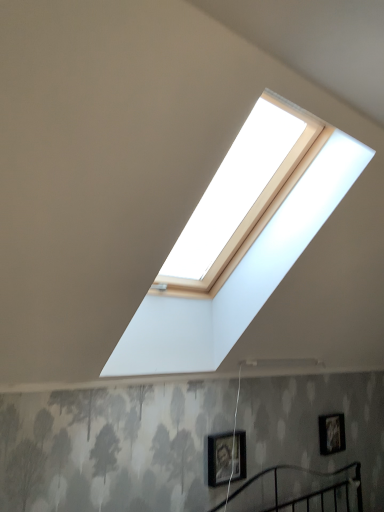
How much space does matte black picture frame at lower center, the second picture frame when ordered from right to left, occupy horizontally?

matte black picture frame at lower center, the second picture frame when ordered from right to left, is 2.41 inches wide.

Locate an element on the screen. This screenshot has height=512, width=384. matte black picture frame at lower center, the 2th picture frame when ordered from back to front is located at coordinates (219, 458).

What do you see at coordinates (219, 458) in the screenshot?
I see `matte black picture frame at lower center, which appears as the first picture frame when viewed from the front` at bounding box center [219, 458].

How much space does matte black picture frame at lower right, which is the 1th picture frame from right to left, occupy horizontally?

The width of matte black picture frame at lower right, which is the 1th picture frame from right to left, is 5.47 centimeters.

How much space does matte black picture frame at lower right, placed as the second picture frame when sorted from left to right, occupy vertically?

matte black picture frame at lower right, placed as the second picture frame when sorted from left to right, is 11.44 inches tall.

Find the location of a particular element. The height and width of the screenshot is (512, 384). matte black picture frame at lower right, the first picture frame viewed from the back is located at coordinates (332, 433).

This screenshot has height=512, width=384. Describe the element at coordinates (332, 433) in the screenshot. I see `matte black picture frame at lower right, the first picture frame viewed from the back` at that location.

This screenshot has height=512, width=384. I want to click on matte black picture frame at lower center, which appears as the first picture frame when viewed from the front, so click(219, 458).

Is matte black picture frame at lower right, marked as the second picture frame in a front-to-back arrangement, to the left of matte black picture frame at lower center, the second picture frame when ordered from right to left, from the viewer's perspective?

No, matte black picture frame at lower right, marked as the second picture frame in a front-to-back arrangement, is not to the left of matte black picture frame at lower center, the second picture frame when ordered from right to left.

Which object is further away from the camera, matte black picture frame at lower right, which is the 1th picture frame from right to left, or matte black picture frame at lower center, which appears as the 1th picture frame when viewed from the left?

matte black picture frame at lower right, which is the 1th picture frame from right to left, is further away from the camera.

Which is in front, point (338, 440) or point (225, 459)?

Point (225, 459)

From the image's perspective, is matte black picture frame at lower right, placed as the second picture frame when sorted from left to right, located above matte black picture frame at lower center, the second picture frame when ordered from right to left?

No.

From a real-world perspective, is matte black picture frame at lower right, which is the 1th picture frame from right to left, above or below matte black picture frame at lower center, the second picture frame when ordered from right to left?

Clearly, from a real-world perspective, matte black picture frame at lower right, which is the 1th picture frame from right to left, is above matte black picture frame at lower center, the second picture frame when ordered from right to left.

Does matte black picture frame at lower right, which is the 1th picture frame from right to left, have a greater width compared to matte black picture frame at lower center, the 2th picture frame when ordered from back to front?

No, matte black picture frame at lower right, which is the 1th picture frame from right to left, is not wider than matte black picture frame at lower center, the 2th picture frame when ordered from back to front.

Does matte black picture frame at lower right, the first picture frame viewed from the back, have a greater height compared to matte black picture frame at lower center, the 2th picture frame when ordered from back to front?

Correct, matte black picture frame at lower right, the first picture frame viewed from the back, is much taller as matte black picture frame at lower center, the 2th picture frame when ordered from back to front.

Between matte black picture frame at lower right, which is the 1th picture frame from right to left, and matte black picture frame at lower center, which appears as the first picture frame when viewed from the front, which one has smaller size?

matte black picture frame at lower right, which is the 1th picture frame from right to left, is smaller.

Is matte black picture frame at lower center, which appears as the first picture frame when viewed from the front, inside matte black picture frame at lower right, placed as the second picture frame when sorted from left to right?

No.

Does matte black picture frame at lower right, marked as the second picture frame in a front-to-back arrangement, touch matte black picture frame at lower center, which appears as the first picture frame when viewed from the front?

No, matte black picture frame at lower right, marked as the second picture frame in a front-to-back arrangement, is not next to matte black picture frame at lower center, which appears as the first picture frame when viewed from the front.

Is matte black picture frame at lower right, marked as the second picture frame in a front-to-back arrangement, facing away from matte black picture frame at lower center, the second picture frame when ordered from right to left?

No.

What's the angular difference between matte black picture frame at lower right, which is the 1th picture frame from right to left, and matte black picture frame at lower center, which appears as the first picture frame when viewed from the front,'s facing directions?

matte black picture frame at lower right, which is the 1th picture frame from right to left, and matte black picture frame at lower center, which appears as the first picture frame when viewed from the front, are facing 0.958 degrees away from each other.

Measure the distance between matte black picture frame at lower right, marked as the second picture frame in a front-to-back arrangement, and matte black picture frame at lower center, which appears as the 1th picture frame when viewed from the left.

35.45 inches.

Find the location of a particular element. picture frame lying above the matte black picture frame at lower right, placed as the second picture frame when sorted from left to right (from the image's perspective) is located at coordinates (219, 458).

Would you say matte black picture frame at lower center, the 2th picture frame when ordered from back to front, is to the left or to the right of matte black picture frame at lower right, marked as the second picture frame in a front-to-back arrangement, in the picture?

matte black picture frame at lower center, the 2th picture frame when ordered from back to front, is positioned on matte black picture frame at lower right, marked as the second picture frame in a front-to-back arrangement,'s left side.

Is matte black picture frame at lower center, which appears as the 1th picture frame when viewed from the left, further to camera compared to matte black picture frame at lower right, placed as the second picture frame when sorted from left to right?

No.

Considering the positions of points (222, 460) and (341, 448), is point (222, 460) farther from camera compared to point (341, 448)?

No, (222, 460) is in front of (341, 448).

From the image's perspective, does matte black picture frame at lower center, which appears as the 1th picture frame when viewed from the left, appear lower than matte black picture frame at lower right, placed as the second picture frame when sorted from left to right?

Actually, matte black picture frame at lower center, which appears as the 1th picture frame when viewed from the left, appears above matte black picture frame at lower right, placed as the second picture frame when sorted from left to right, in the image.

Based on the photo, from a real-world perspective, which is physically above, matte black picture frame at lower center, which appears as the 1th picture frame when viewed from the left, or matte black picture frame at lower right, the first picture frame viewed from the back?

matte black picture frame at lower right, the first picture frame viewed from the back, is physically above.

Does matte black picture frame at lower center, the 2th picture frame when ordered from back to front, have a lesser width compared to matte black picture frame at lower right, marked as the second picture frame in a front-to-back arrangement?

No.

Considering the relative sizes of matte black picture frame at lower center, the 2th picture frame when ordered from back to front, and matte black picture frame at lower right, which is the 1th picture frame from right to left, in the image provided, is matte black picture frame at lower center, the 2th picture frame when ordered from back to front, taller than matte black picture frame at lower right, which is the 1th picture frame from right to left,?

No, matte black picture frame at lower center, the 2th picture frame when ordered from back to front, is not taller than matte black picture frame at lower right, which is the 1th picture frame from right to left.

Considering the sizes of objects matte black picture frame at lower center, which appears as the 1th picture frame when viewed from the left, and matte black picture frame at lower right, marked as the second picture frame in a front-to-back arrangement, in the image provided, who is bigger, matte black picture frame at lower center, which appears as the 1th picture frame when viewed from the left, or matte black picture frame at lower right, marked as the second picture frame in a front-to-back arrangement,?

matte black picture frame at lower center, which appears as the 1th picture frame when viewed from the left.

Do you think matte black picture frame at lower center, which appears as the 1th picture frame when viewed from the left, is within matte black picture frame at lower right, the first picture frame viewed from the back, or outside of it?

matte black picture frame at lower center, which appears as the 1th picture frame when viewed from the left, is outside matte black picture frame at lower right, the first picture frame viewed from the back.

Is matte black picture frame at lower center, the second picture frame when ordered from right to left, touching matte black picture frame at lower right, which is the 1th picture frame from right to left?

They are not placed beside each other.

Could you tell me if matte black picture frame at lower center, which appears as the first picture frame when viewed from the front, is turned towards matte black picture frame at lower right, marked as the second picture frame in a front-to-back arrangement?

No, matte black picture frame at lower center, which appears as the first picture frame when viewed from the front, is not turned towards matte black picture frame at lower right, marked as the second picture frame in a front-to-back arrangement.

How many degrees apart are the facing directions of matte black picture frame at lower center, which appears as the 1th picture frame when viewed from the left, and matte black picture frame at lower right, the first picture frame viewed from the back?

The facing directions of matte black picture frame at lower center, which appears as the 1th picture frame when viewed from the left, and matte black picture frame at lower right, the first picture frame viewed from the back, are 0.958 degrees apart.

Could you measure the distance between matte black picture frame at lower center, the 2th picture frame when ordered from back to front, and matte black picture frame at lower right, marked as the second picture frame in a front-to-back arrangement?

matte black picture frame at lower center, the 2th picture frame when ordered from back to front, and matte black picture frame at lower right, marked as the second picture frame in a front-to-back arrangement, are 90.04 centimeters apart.

At what (x,y) coordinates should I click in order to perform the action: click on picture frame on the left of the matte black picture frame at lower right, the first picture frame viewed from the back. Please return your answer as a coordinate pair (x, y). Looking at the image, I should click on (219, 458).

At what (x,y) coordinates should I click in order to perform the action: click on picture frame to the right of matte black picture frame at lower center, which appears as the first picture frame when viewed from the front. Please return your answer as a coordinate pair (x, y). The image size is (384, 512). Looking at the image, I should click on (332, 433).

You are a GUI agent. You are given a task and a screenshot of the screen. Output one action in this format:
    pyautogui.click(x=<x>, y=<y>)
    Task: Click on the picture frame behind the matte black picture frame at lower center, which appears as the 1th picture frame when viewed from the left
    The height and width of the screenshot is (512, 384).
    Given the screenshot: What is the action you would take?
    pyautogui.click(x=332, y=433)